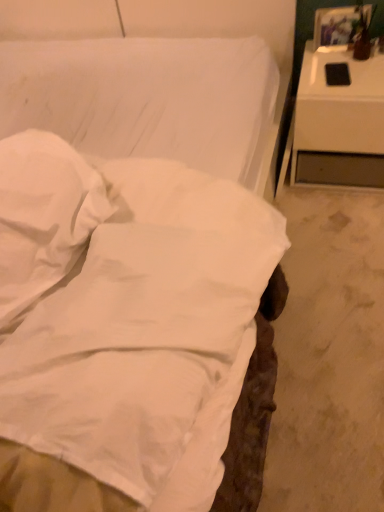
What are the coordinates of `white glossy nightstand at right` in the screenshot? It's located at (338, 106).

This screenshot has height=512, width=384. What do you see at coordinates (361, 33) in the screenshot?
I see `matte brown vase at upper right` at bounding box center [361, 33].

Identify the location of white glossy nightstand at right. (338, 106).

Which object is further away from the camera taking this photo, white glossy nightstand at right or matte brown vase at upper right?

matte brown vase at upper right is more distant.

Is white glossy nightstand at right shorter than matte brown vase at upper right?

Incorrect, the height of white glossy nightstand at right does not fall short of that of matte brown vase at upper right.

From the image's perspective, between white glossy nightstand at right and matte brown vase at upper right, who is located below?

white glossy nightstand at right.

Which is nearer, (378, 80) or (363, 44)?

Positioned in front is point (378, 80).

Considering the relative sizes of white soft pillow at center and matte brown vase at upper right in the image provided, is white soft pillow at center taller than matte brown vase at upper right?

Incorrect, the height of white soft pillow at center is not larger of that of matte brown vase at upper right.

Between white soft pillow at center and matte brown vase at upper right, which one is positioned in front?

white soft pillow at center.

Which is further, [17,247] or [367,19]?

The point [367,19] is farther from the camera.

From a real-world perspective, does white soft pillow at center sit lower than matte brown vase at upper right?

No, from a real-world perspective, white soft pillow at center is not below matte brown vase at upper right.

How different are the orientations of matte brown vase at upper right and white soft pillow at center in degrees?

There is a 64-degree angle between the facing directions of matte brown vase at upper right and white soft pillow at center.

Is matte brown vase at upper right in front of or behind white soft pillow at center in the image?

matte brown vase at upper right is behind white soft pillow at center.

Could you tell me if matte brown vase at upper right is facing white soft pillow at center?

No, matte brown vase at upper right is not oriented towards white soft pillow at center.

Is matte brown vase at upper right bigger than white soft pillow at center?

No, matte brown vase at upper right is not bigger than white soft pillow at center.

Considering the sizes of objects white glossy nightstand at right and white soft pillow at center in the image provided, who is shorter, white glossy nightstand at right or white soft pillow at center?

With less height is white soft pillow at center.

Considering the positions of points (341, 110) and (85, 204), is point (341, 110) closer to camera compared to point (85, 204)?

No, it is not.

How different are the orientations of white glossy nightstand at right and white soft pillow at center in degrees?

white glossy nightstand at right and white soft pillow at center are facing 66.8 degrees away from each other.

Is white glossy nightstand at right oriented towards white soft pillow at center?

No, white glossy nightstand at right is not oriented towards white soft pillow at center.

Is white soft pillow at center oriented away from white glossy nightstand at right?

white soft pillow at center does not have its back to white glossy nightstand at right.

Visually, is white soft pillow at center positioned to the left or to the right of white glossy nightstand at right?

Based on their positions, white soft pillow at center is located to the left of white glossy nightstand at right.

Which of these two, white soft pillow at center or white glossy nightstand at right, is bigger?

With larger size is white glossy nightstand at right.

Relative to white glossy nightstand at right, is white soft pillow at center in front or behind?

white soft pillow at center is in front of white glossy nightstand at right.

Is matte brown vase at upper right bigger or smaller than white glossy nightstand at right?

In the image, matte brown vase at upper right appears to be smaller than white glossy nightstand at right.

From a real-world perspective, is matte brown vase at upper right on white glossy nightstand at right?

Yes, from a real-world perspective, matte brown vase at upper right is over white glossy nightstand at right

Considering the relative positions of matte brown vase at upper right and white glossy nightstand at right in the image provided, is matte brown vase at upper right to the left or to the right of white glossy nightstand at right?

Clearly, matte brown vase at upper right is on the right of white glossy nightstand at right in the image.

The width and height of the screenshot is (384, 512). In order to click on nightstand that is in front of the matte brown vase at upper right in this screenshot , I will do tap(338, 106).

Find the location of a particular element. table lamp above the white soft pillow at center (from the image's perspective) is located at coordinates (361, 33).

Looking at the image, which one is located closer to white glossy nightstand at right, white soft pillow at center or matte brown vase at upper right?

matte brown vase at upper right is closer to white glossy nightstand at right.

Looking at the image, which one is located closer to matte brown vase at upper right, white soft pillow at center or white glossy nightstand at right?

Among the two, white glossy nightstand at right is located nearer to matte brown vase at upper right.

From the image, which object appears to be nearer to white soft pillow at center, matte brown vase at upper right or white glossy nightstand at right?

white glossy nightstand at right is closer to white soft pillow at center.

Based on their spatial positions, is matte brown vase at upper right or white soft pillow at center closer to white glossy nightstand at right?

matte brown vase at upper right.

Looking at the image, which one is located closer to white soft pillow at center, white glossy nightstand at right or matte brown vase at upper right?

white glossy nightstand at right is positioned closer to the anchor white soft pillow at center.

Estimate the real-world distances between objects in this image. Which object is further from matte brown vase at upper right, white glossy nightstand at right or white soft pillow at center?

white soft pillow at center lies further to matte brown vase at upper right than the other object.

In order to click on nightstand located between white soft pillow at center and matte brown vase at upper right in the left-right direction in this screenshot , I will do `click(338, 106)`.